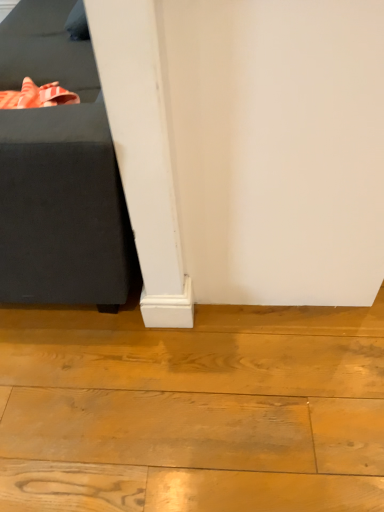
Find the location of `natural wood floor at lower left`. natural wood floor at lower left is located at coordinates pyautogui.click(x=193, y=410).

What do you see at coordinates (193, 410) in the screenshot?
I see `natural wood floor at lower left` at bounding box center [193, 410].

The image size is (384, 512). Identify the location of black fabric ottoman at left. (59, 174).

What do you see at coordinates (59, 174) in the screenshot? I see `black fabric ottoman at left` at bounding box center [59, 174].

Measure the distance between black fabric ottoman at left and camera.

A distance of 32.76 inches exists between black fabric ottoman at left and camera.

This screenshot has height=512, width=384. I want to click on natural wood floor at lower left, so 193,410.

Considering the positions of objects black fabric ottoman at left and natural wood floor at lower left in the image provided, who is more to the left, black fabric ottoman at left or natural wood floor at lower left?

black fabric ottoman at left.

Which object is more forward, black fabric ottoman at left or natural wood floor at lower left?

black fabric ottoman at left.

Does point (51, 268) lie in front of point (287, 412)?

No, it is behind (287, 412).

From the image's perspective, would you say black fabric ottoman at left is shown under natural wood floor at lower left?

No, from the image's perspective, black fabric ottoman at left is not below natural wood floor at lower left.

From a real-world perspective, which object stands above the other?

black fabric ottoman at left.

Looking at their sizes, would you say black fabric ottoman at left is wider or thinner than natural wood floor at lower left?

In the image, black fabric ottoman at left appears to be more narrow than natural wood floor at lower left.

Which of these two, black fabric ottoman at left or natural wood floor at lower left, stands taller?

With more height is black fabric ottoman at left.

Can you confirm if black fabric ottoman at left is smaller than natural wood floor at lower left?

Incorrect, black fabric ottoman at left is not smaller in size than natural wood floor at lower left.

Choose the correct answer: Is black fabric ottoman at left inside natural wood floor at lower left or outside it?

black fabric ottoman at left cannot be found inside natural wood floor at lower left.

Is black fabric ottoman at left not near natural wood floor at lower left?

No.

Is black fabric ottoman at left aimed at natural wood floor at lower left?

No, black fabric ottoman at left is not facing towards natural wood floor at lower left.

What's the angular difference between black fabric ottoman at left and natural wood floor at lower left's facing directions?

The angle between the facing direction of black fabric ottoman at left and the facing direction of natural wood floor at lower left is 178 degrees.

From the picture: Measure the distance from black fabric ottoman at left to natural wood floor at lower left.

A distance of 41.86 centimeters exists between black fabric ottoman at left and natural wood floor at lower left.

Locate an element on the screen. This screenshot has width=384, height=512. furniture located above the natural wood floor at lower left (from the image's perspective) is located at coordinates (59, 174).

Which is more to the left, natural wood floor at lower left or black fabric ottoman at left?

black fabric ottoman at left is more to the left.

Considering the positions of objects natural wood floor at lower left and black fabric ottoman at left in the image provided, who is behind, natural wood floor at lower left or black fabric ottoman at left?

Positioned behind is natural wood floor at lower left.

Between point (5, 499) and point (135, 271), which one is positioned behind?

The point (135, 271) is farther from the camera.

From the image's perspective, is natural wood floor at lower left on black fabric ottoman at left?

No, from the image's perspective, natural wood floor at lower left is not over black fabric ottoman at left.

From a real-world perspective, between natural wood floor at lower left and black fabric ottoman at left, who is vertically lower?

In real-world perspective, natural wood floor at lower left is lower.

Consider the image. Looking at their sizes, would you say natural wood floor at lower left is wider or thinner than black fabric ottoman at left?

In the image, natural wood floor at lower left appears to be wider than black fabric ottoman at left.

Looking at this image, does natural wood floor at lower left have a lesser height compared to black fabric ottoman at left?

Indeed, natural wood floor at lower left has a lesser height compared to black fabric ottoman at left.

Based on their sizes in the image, would you say natural wood floor at lower left is bigger or smaller than black fabric ottoman at left?

In the image, natural wood floor at lower left appears to be smaller than black fabric ottoman at left.

Consider the image. Which is correct: natural wood floor at lower left is inside black fabric ottoman at left, or outside of it?

natural wood floor at lower left is located beyond the bounds of black fabric ottoman at left.

Based on the photo, is natural wood floor at lower left far away from black fabric ottoman at left?

natural wood floor at lower left is near black fabric ottoman at left, not far away.

Is black fabric ottoman at left at the back of natural wood floor at lower left?

No, black fabric ottoman at left is not at the back of natural wood floor at lower left.

How different are the orientations of natural wood floor at lower left and black fabric ottoman at left in degrees?

The angular difference between natural wood floor at lower left and black fabric ottoman at left is 178 degrees.

Where is `wood lying on the right of black fabric ottoman at left`? The image size is (384, 512). wood lying on the right of black fabric ottoman at left is located at coordinates [x=193, y=410].

Where is `furniture above the natural wood floor at lower left (from the image's perspective)`? furniture above the natural wood floor at lower left (from the image's perspective) is located at coordinates (59, 174).

Find the location of `wood below the black fabric ottoman at left (from the image's perspective)`. wood below the black fabric ottoman at left (from the image's perspective) is located at coordinates (193, 410).